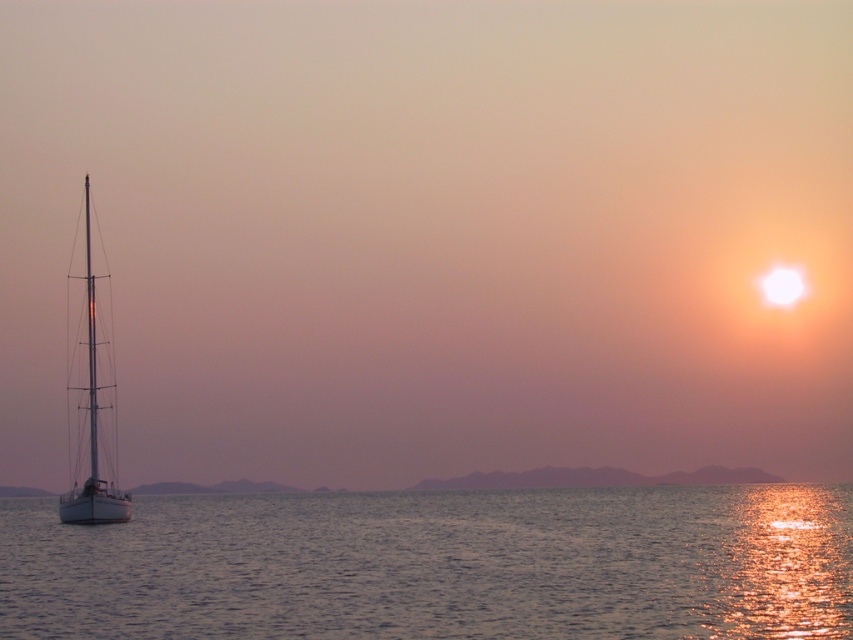
Question: Which point is closer to the camera taking this photo?

Choices:
 (A) (734, 538)
 (B) (74, 515)

Answer: (A)

Question: Which object appears farthest from the camera in this image?

Choices:
 (A) glistening silver water at lower left
 (B) white glossy sailboat at left

Answer: (B)

Question: Does glistening silver water at lower left have a smaller size compared to white glossy sailboat at left?

Choices:
 (A) yes
 (B) no

Answer: (A)

Question: Does glistening silver water at lower left appear on the right side of white glossy sailboat at left?

Choices:
 (A) yes
 (B) no

Answer: (A)

Question: Does glistening silver water at lower left appear on the right side of white glossy sailboat at left?

Choices:
 (A) no
 (B) yes

Answer: (B)

Question: Which point is closer to the camera?

Choices:
 (A) white glossy sailboat at left
 (B) glistening silver water at lower left

Answer: (B)